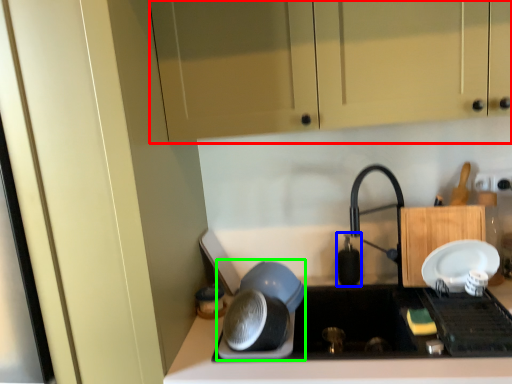
Question: Based on their relative distances, which object is nearer to cabinetry (highlighted by a red box)? Choose from appliance (highlighted by a blue box) and appliance (highlighted by a green box).

Choices:
 (A) appliance
 (B) appliance

Answer: (B)